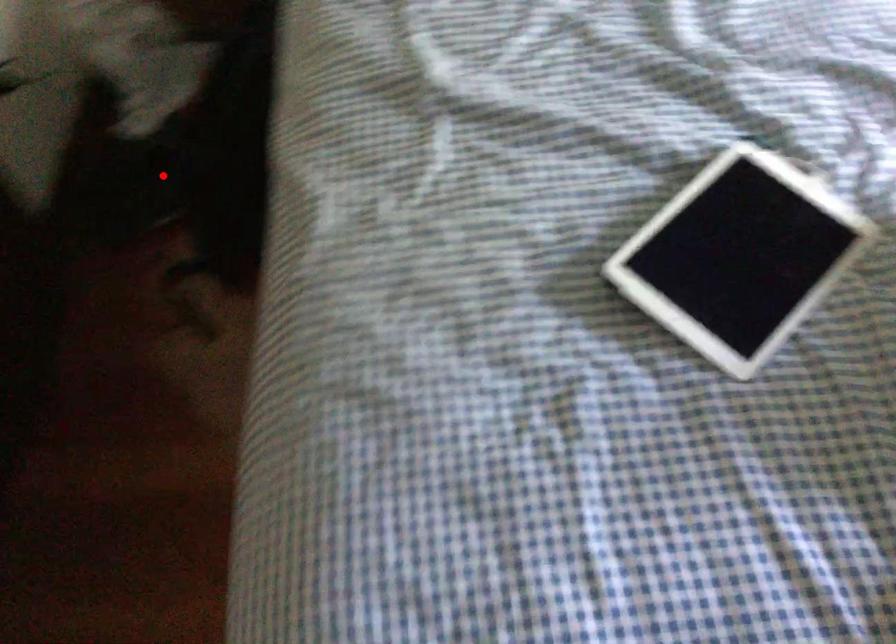
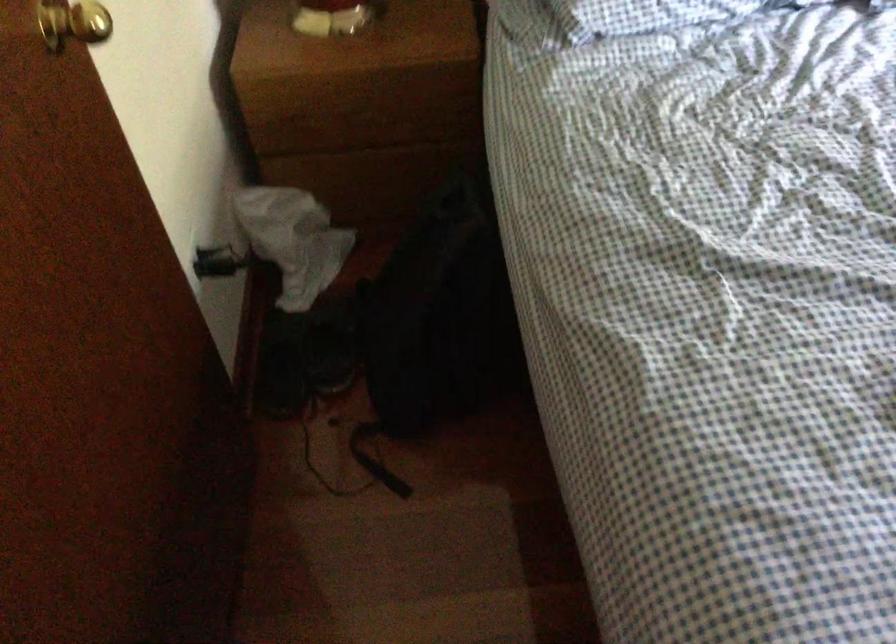
Locate, in the second image, the point that corresponds to the highlighted location in the first image.

(332, 345)